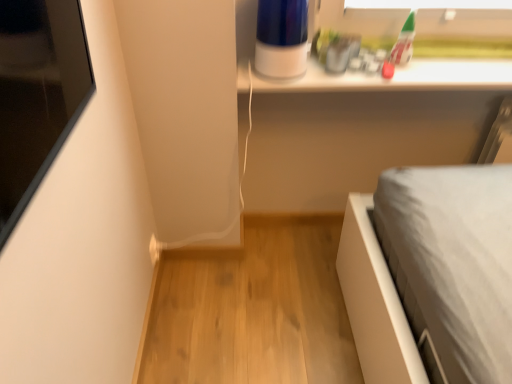
The image size is (512, 384). Find the location of `empty space that is ontop of white glossy shelf at upper center`. empty space that is ontop of white glossy shelf at upper center is located at coordinates (413, 64).